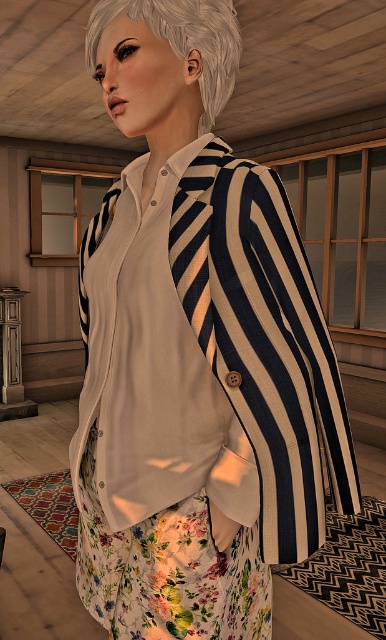
You are a fashion stylist trying to decide whether to place a decorative pin on the white matte hair at upper center or the white matte tie at center. Which object has a larger surface area to accommodate the pin?

The white matte hair at upper center might be wider than the white matte tie at center, so it likely has a larger surface area to accommodate the decorative pin.

Looking at this image, you are a fashion designer observing the person in the image. You need to decide which tie, the striped fabric tie at center or the white matte tie at center, would be more appropriate to pair with a narrow collar. Based on their thickness, which one do you recommend?

The striped fabric tie at center is thinner than the white matte tie at center, so it would be more appropriate to pair with a narrow collar.